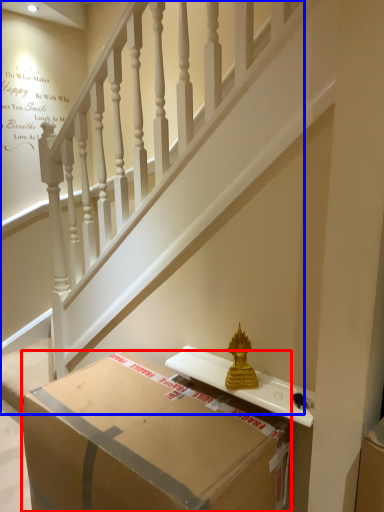
Question: Which point is further to the camera, box (highlighted by a red box) or stairs (highlighted by a blue box)?

Choices:
 (A) box
 (B) stairs

Answer: (B)